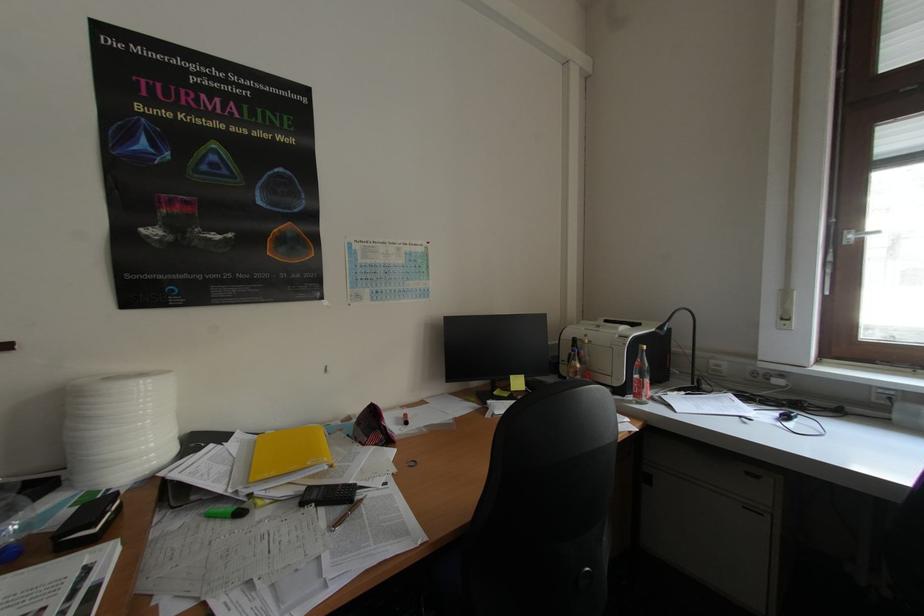
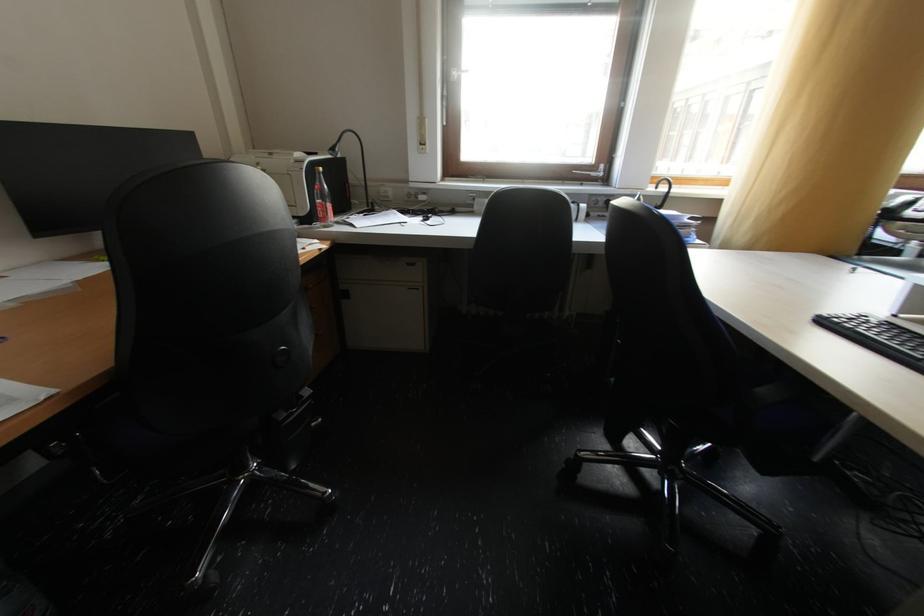
In the scene shown: Based on the continuous images, in which direction is the camera rotating?

The rotation direction of the camera is right-down.